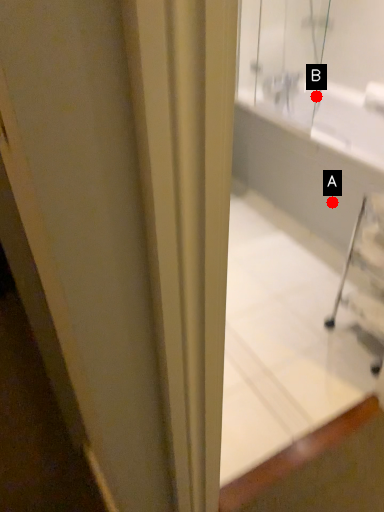
Question: Two points are circled on the image, labeled by A and B beside each circle. Which of the following is the closest to the observer?

Choices:
 (A) A is closer
 (B) B is closer

Answer: (A)